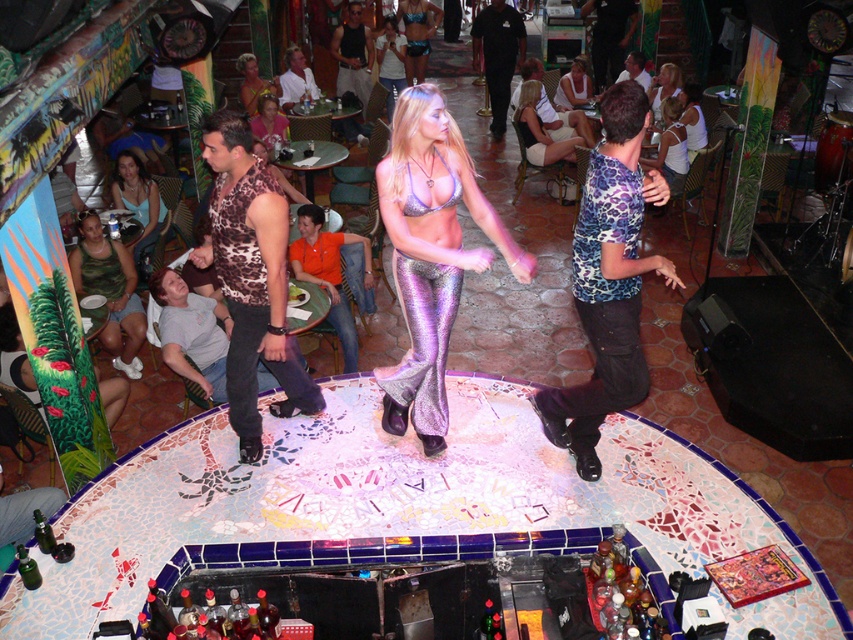
Question: Considering the real-world distances, which object is closest to the gray cotton shirt at lower left?

Choices:
 (A) orange shirt at center
 (B) leopard print shirt at center
 (C) shiny purple fabric dress at center
 (D) matte white tank top at center

Answer: (A)

Question: Which point is farther to the camera?

Choices:
 (A) (677, 80)
 (B) (345, 81)
 (C) (666, 148)
 (D) (283, 92)

Answer: (B)

Question: Observing the image, what is the correct spatial positioning of leopard print tank top at center in reference to shiny silver pants at center?

Choices:
 (A) below
 (B) above

Answer: (A)

Question: Which of the following is the farthest from the observer?

Choices:
 (A) black smooth pants at center
 (B) shiny blue bikini at center
 (C) beige fabric bikini top at center
 (D) leopard print tank top at center

Answer: (B)

Question: Does leopard print shirt at center have a smaller size compared to gray cotton shirt at lower left?

Choices:
 (A) no
 (B) yes

Answer: (A)

Question: Can you confirm if white mesh tank top at center is bigger than shiny silver pants at center?

Choices:
 (A) yes
 (B) no

Answer: (B)